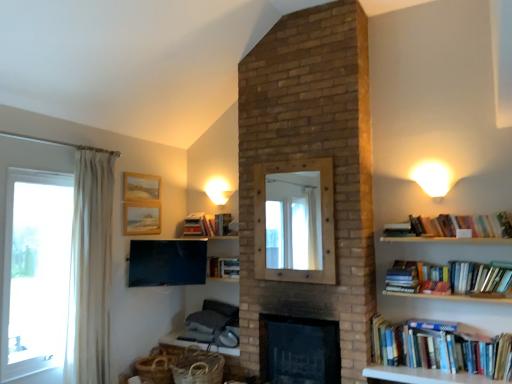
Image resolution: width=512 pixels, height=384 pixels. Describe the element at coordinates (167, 262) in the screenshot. I see `matte black tv at upper left` at that location.

In order to face clear glass window at left, should I rotate leftwards or rightwards?

It's best to rotate left around 26.944 degrees.

Describe the element at coordinates (52, 269) in the screenshot. I see `clear glass window at left` at that location.

You are a GUI agent. You are given a task and a screenshot of the screen. Output one action in this format:
    pyautogui.click(x=<x>, y=<y>)
    Task: Click on the hardcover book at upper center, the third book in the bottom-to-top sequence
    The image size is (512, 384).
    Given the screenshot: What is the action you would take?
    pyautogui.click(x=194, y=225)

The image size is (512, 384). Describe the element at coordinates (218, 191) in the screenshot. I see `white matte wall sconce at upper center, positioned as the 2th light fixture in right-to-left order` at that location.

This screenshot has width=512, height=384. What do you see at coordinates (141, 187) in the screenshot?
I see `wooden picture frame at upper left, marked as the 1th picture frame in a top-to-bottom arrangement` at bounding box center [141, 187].

The height and width of the screenshot is (384, 512). I want to click on wooden picture frame at upper left, positioned as the 2th picture frame in bottom-to-top order, so click(141, 187).

Locate an element on the screen. matte black tv at upper left is located at coordinates (167, 262).

Is wooden mirror at center wider or thinner than matte black tv at upper left?

Considering their sizes, wooden mirror at center looks slimmer than matte black tv at upper left.

Is wooden mirror at center aimed at matte black tv at upper left?

No, wooden mirror at center does not turn towards matte black tv at upper left.

Does wooden mirror at center have a greater height compared to matte black tv at upper left?

Yes, wooden mirror at center is taller than matte black tv at upper left.

Is wooden textured picture frame at upper left, which is counted as the first picture frame, starting from the bottom, located outside woven brown basket at lower center?

Yes, wooden textured picture frame at upper left, which is counted as the first picture frame, starting from the bottom, is located beyond the bounds of woven brown basket at lower center.

Is wooden textured picture frame at upper left, which is counted as the first picture frame, starting from the bottom, oriented towards woven brown basket at lower center?

No, wooden textured picture frame at upper left, which is counted as the first picture frame, starting from the bottom, is not turned towards woven brown basket at lower center.

Is wooden textured picture frame at upper left, arranged as the 2th picture frame when viewed from the top, beside woven brown basket at lower center?

No, wooden textured picture frame at upper left, arranged as the 2th picture frame when viewed from the top, is not with woven brown basket at lower center.

Which object is positioned more to the left, wooden textured picture frame at upper left, arranged as the 2th picture frame when viewed from the top, or woven brown basket at lower center?

From the viewer's perspective, wooden textured picture frame at upper left, arranged as the 2th picture frame when viewed from the top, appears more on the left side.

Does point (102, 380) come behind point (422, 222)?

Yes, point (102, 380) is behind point (422, 222).

Is clear glass window at left touching hardcover books at right, which is the 3th book in back-to-front order?

There is a gap between clear glass window at left and hardcover books at right, which is the 3th book in back-to-front order.

Based on the photo, from the image's perspective, relative to hardcover books at right, which ranks as the fourth book in bottom-to-top order, is clear glass window at left above or below?

Based on their image positions, clear glass window at left is located beneath hardcover books at right, which ranks as the fourth book in bottom-to-top order.

How many degrees apart are the facing directions of clear glass window at left and hardcover books at right, which is the 3th book in back-to-front order?

93.5 degrees separate the facing orientations of clear glass window at left and hardcover books at right, which is the 3th book in back-to-front order.

Between white fabric curtain at left and black brick fireplace at center, which one appears on the left side from the viewer's perspective?

Positioned to the left is white fabric curtain at left.

Relative to black brick fireplace at center, is white fabric curtain at left in front or behind?

Clearly, white fabric curtain at left is in front of black brick fireplace at center.

Based on the photo, from the image's perspective, which one is positioned higher, white fabric curtain at left or black brick fireplace at center?

white fabric curtain at left, from the image's perspective.

Is white matte wall sconce at upper center, which appears as the first light fixture when viewed from the left, looking in the opposite direction of white wood table at lower center?

No, white matte wall sconce at upper center, which appears as the first light fixture when viewed from the left, is not facing away from white wood table at lower center.

Is white matte wall sconce at upper center, positioned as the 2th light fixture in right-to-left order, to the left or to the right of white wood table at lower center in the image?

In the image, white matte wall sconce at upper center, positioned as the 2th light fixture in right-to-left order, appears on the right side of white wood table at lower center.

Is white matte wall sconce at upper center, placed as the 1th light fixture when sorted from back to front, not close to white wood table at lower center?

white matte wall sconce at upper center, placed as the 1th light fixture when sorted from back to front, is positioned a significant distance from white wood table at lower center.

Considering the relative sizes of white matte wall sconce at upper center, the second light fixture viewed from the front, and white wood table at lower center in the image provided, is white matte wall sconce at upper center, the second light fixture viewed from the front, thinner than white wood table at lower center?

Yes, white matte wall sconce at upper center, the second light fixture viewed from the front, is thinner than white wood table at lower center.

Where is `fireplace below the wooden textured picture frame at upper left, arranged as the 2th picture frame when viewed from the top (from the image's perspective)`? fireplace below the wooden textured picture frame at upper left, arranged as the 2th picture frame when viewed from the top (from the image's perspective) is located at coordinates (298, 350).

Is wooden textured picture frame at upper left, arranged as the 2th picture frame when viewed from the top, positioned before black brick fireplace at center?

That is False.

Is point (159, 214) positioned behind point (263, 367)?

Yes, point (159, 214) is behind point (263, 367).

Considering the sizes of wooden textured picture frame at upper left, arranged as the 2th picture frame when viewed from the top, and black brick fireplace at center in the image, is wooden textured picture frame at upper left, arranged as the 2th picture frame when viewed from the top, bigger or smaller than black brick fireplace at center?

wooden textured picture frame at upper left, arranged as the 2th picture frame when viewed from the top, is smaller than black brick fireplace at center.

Between wooden picture frame at upper left, marked as the 1th picture frame in a top-to-bottom arrangement, and matte black tv at upper left, which one has more height?

Standing taller between the two is matte black tv at upper left.

Is wooden picture frame at upper left, positioned as the 2th picture frame in bottom-to-top order, closer to the viewer compared to matte black tv at upper left?

No, it is not.

Does wooden picture frame at upper left, positioned as the 2th picture frame in bottom-to-top order, touch matte black tv at upper left?

No, wooden picture frame at upper left, positioned as the 2th picture frame in bottom-to-top order, is not with matte black tv at upper left.

From a real-world perspective, which is physically below, wooden picture frame at upper left, marked as the 1th picture frame in a top-to-bottom arrangement, or matte black tv at upper left?

matte black tv at upper left, from a real-world perspective.

At what (x,y) coordinates should I click in order to perform the action: click on mirror that is above the matte black tv at upper left (from a real-world perspective). Please return your answer as a coordinate pair (x, y). Looking at the image, I should click on (294, 221).

Where is `basket located below the wooden textured picture frame at upper left, arranged as the 2th picture frame when viewed from the top (from the image's perspective)`? The image size is (512, 384). basket located below the wooden textured picture frame at upper left, arranged as the 2th picture frame when viewed from the top (from the image's perspective) is located at coordinates (198, 367).

From the picture: From the image, which object appears to be farther from wooden mirror at center, matte black tv at upper left or hardcover book at upper center, the third book in the bottom-to-top sequence?

hardcover book at upper center, the third book in the bottom-to-top sequence, lies further to wooden mirror at center than the other object.

Considering their positions, is white matte wall sconce at upper center, which appears as the first light fixture when viewed from the left, positioned closer to wooden textured picture frame at upper left, which is counted as the first picture frame, starting from the bottom, than matte black tv at upper left?

matte black tv at upper left.

Estimate the real-world distances between objects in this image. Which object is further from white wood table at lower center, wooden picture frame at upper left, marked as the 1th picture frame in a top-to-bottom arrangement, or hardcover books at right, which ranks as the 2th book in front-to-back order?

hardcover books at right, which ranks as the 2th book in front-to-back order, is further to white wood table at lower center.

Looking at the image, which one is located closer to white matte wall sconce at upper right, the 1th light fixture positioned from the front, wooden picture frame at upper left, marked as the 1th picture frame in a top-to-bottom arrangement, or hardcover books at right, which is counted as the first book, starting from the bottom?

hardcover books at right, which is counted as the first book, starting from the bottom, is closer to white matte wall sconce at upper right, the 1th light fixture positioned from the front.

Estimate the real-world distances between objects in this image. Which object is further from wooden mirror at center, hardcover book at upper center, which is counted as the fourth book, starting from the right, or wooden textured picture frame at upper left, arranged as the 2th picture frame when viewed from the top?

wooden textured picture frame at upper left, arranged as the 2th picture frame when viewed from the top, is further to wooden mirror at center.

Considering their positions, is hardcover books at right, which ranks as the fourth book in bottom-to-top order, positioned closer to hardcover book at center, the 3th book from the front, than white matte wall sconce at upper right, the 1th light fixture positioned from the front?

Based on the image, white matte wall sconce at upper right, the 1th light fixture positioned from the front, appears to be nearer to hardcover book at center, the 3th book from the front.

Estimate the real-world distances between objects in this image. Which object is further from white matte wall sconce at upper center, placed as the 1th light fixture when sorted from back to front, white fabric curtain at left or white wood table at lower center?

white fabric curtain at left.

From the image, which object appears to be farther from white wood table at lower center, hardcover books at right, which ranks as the 2th book in front-to-back order, or white matte wall sconce at upper center, which appears as the first light fixture when viewed from the left?

Based on the image, hardcover books at right, which ranks as the 2th book in front-to-back order, appears to be further to white wood table at lower center.

You are a GUI agent. You are given a task and a screenshot of the screen. Output one action in this format:
    pyautogui.click(x=<x>, y=<y>)
    Task: Click on the fireplace between hardcover book at upper center, the 2th book from the top, and woven brown basket at lower center vertically
    This screenshot has width=512, height=384.
    Given the screenshot: What is the action you would take?
    pyautogui.click(x=298, y=350)

Where is `fireplace between hardcover book at upper center, the third book in the bottom-to-top sequence, and white wood table at lower center from top to bottom`? fireplace between hardcover book at upper center, the third book in the bottom-to-top sequence, and white wood table at lower center from top to bottom is located at coordinates (298, 350).

This screenshot has height=384, width=512. I want to click on television situated between wooden textured picture frame at upper left, which is counted as the first picture frame, starting from the bottom, and white matte wall sconce at upper right, the 1th light fixture positioned from the front, from left to right, so click(167, 262).

The image size is (512, 384). I want to click on fireplace between wooden textured picture frame at upper left, which is counted as the first picture frame, starting from the bottom, and hardcover books at right, acting as the first book starting from the right, so click(298, 350).